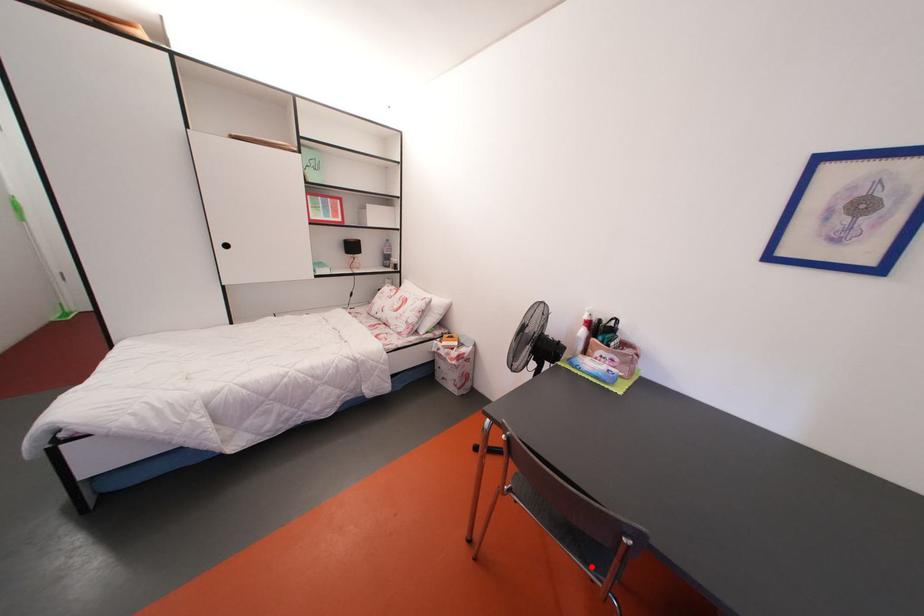
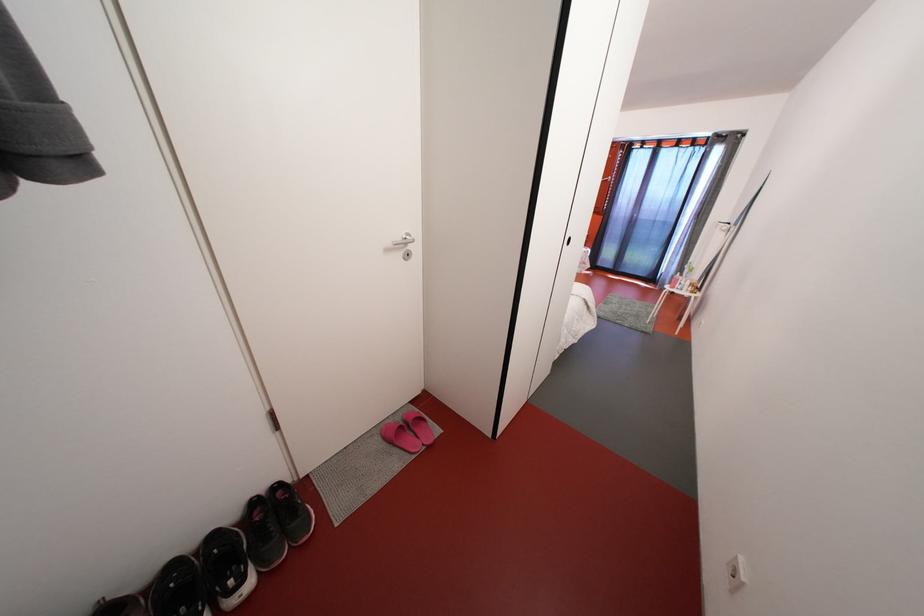
Question: I am providing you with two images of the same scene from different viewpoints. A red point is marked on the first image. At the location where the point appears in image 1, is it still visible in image 2?

Choices:
 (A) Yes
 (B) No

Answer: (B)